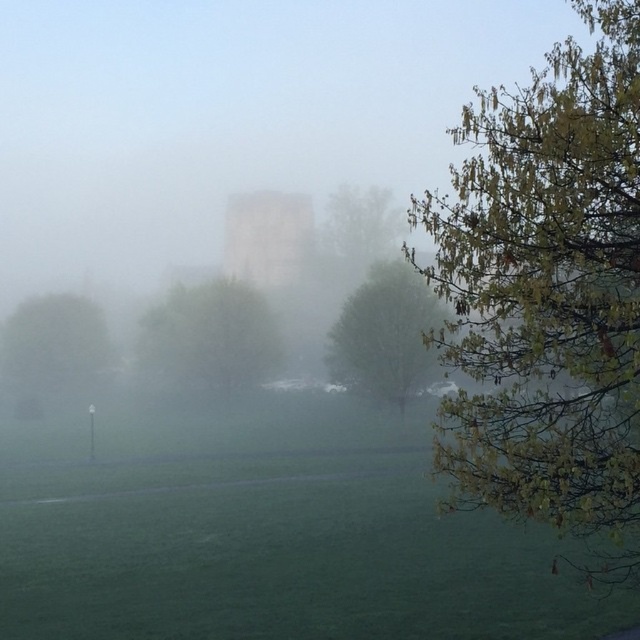
Question: Which point is closer to the camera?

Choices:
 (A) green leafy tree at center
 (B) green matte tree at center

Answer: (B)

Question: Does yellow-green leaves at right appear on the left side of green matte tree at left?

Choices:
 (A) yes
 (B) no

Answer: (B)

Question: Can you confirm if green matte tree at left is bigger than green leafy tree at center?

Choices:
 (A) no
 (B) yes

Answer: (A)

Question: Which of these objects is positioned closest to the yellow-green leaves at right?

Choices:
 (A) green leafy tree at upper right
 (B) green leafy tree at center
 (C) green matte tree at left
 (D) green matte tree at center

Answer: (A)

Question: In this image, where is yellow-green leaves at right located relative to green leafy tree at upper right?

Choices:
 (A) above
 (B) below

Answer: (A)

Question: Among these objects, which one is farthest from the camera?

Choices:
 (A) green leafy tree at center
 (B) green leafy tree at upper right
 (C) yellow-green leaves at right

Answer: (A)